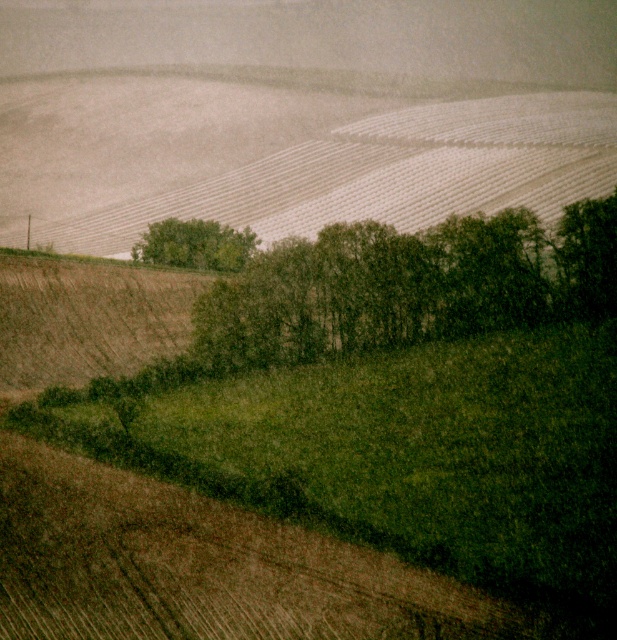
You are standing at the origin point of the image coordinate system. You want to walk to the green leafy trees at center. Which direction should you move in terms of x and y coordinates?

The green leafy trees at center are located at coordinate point 0.448 in the x direction and 0.660 in the y direction. Since you are at the origin, you should move in the positive x and positive y directions to reach them.

A farmer wants to install a fence between the green leafy trees at center and the white plastic sheeting field in the background. If the distance between the trees and the field is exactly 106.91 meters, what is the minimum length of fencing material needed in meters?

The minimum length of fencing material needed is 106.91 meters, as the distance between the green leafy trees at center and the white plastic sheeting field in the background is exactly 106.91 meters.